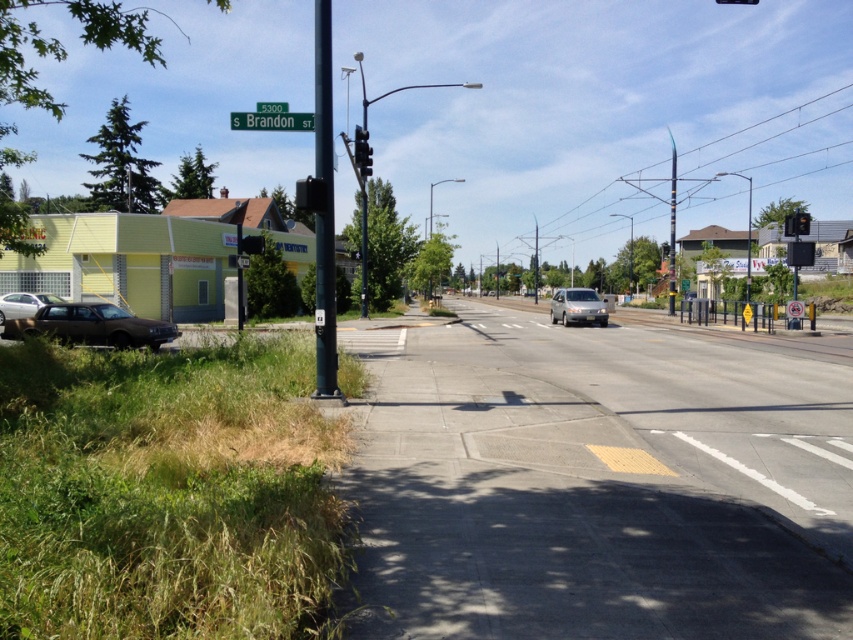
Question: Considering the relative positions of matte black car at lower left and metallic rectangular traffic light at upper right in the image provided, where is matte black car at lower left located with respect to metallic rectangular traffic light at upper right?

Choices:
 (A) right
 (B) left

Answer: (B)

Question: Which object is positioned farthest from the concrete sidewalk at center?

Choices:
 (A) metallic pole at upper right
 (B) metallic rectangular traffic light at right
 (C) metallic pole at center
 (D) black plastic traffic light at upper right

Answer: (A)

Question: Does green metallic street sign at upper center appear over red glass traffic light at upper right?

Choices:
 (A) no
 (B) yes

Answer: (B)

Question: Which object appears closest to the camera in this image?

Choices:
 (A) green plastic street sign at upper center
 (B) metallic pole at center
 (C) metallic rectangular traffic light at right

Answer: (A)

Question: Which is farther from the matte black car at lower left?

Choices:
 (A) satin silver sedan at center-right
 (B) metallic rectangular traffic light at right
 (C) metallic rectangular traffic light at upper right

Answer: (C)

Question: Is concrete sidewalk at center positioned in front of satin silver sedan at center-right?

Choices:
 (A) yes
 (B) no

Answer: (A)